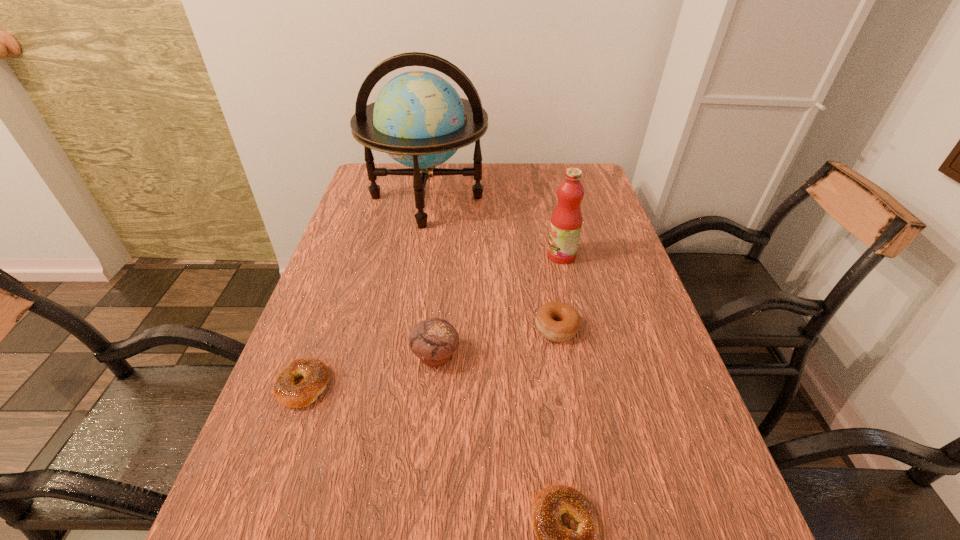
Locate an element on the screen. the tallest object is located at coordinates (418, 119).

Where is `globe`? globe is located at coordinates (418, 119).

Locate an element on the screen. This screenshot has height=540, width=960. the second tallest object is located at coordinates (566, 221).

Locate an element on the screen. the fifth nearest object is located at coordinates (566, 221).

Where is `the third tallest object`? This screenshot has height=540, width=960. the third tallest object is located at coordinates (434, 340).

Find the location of a particular element. This screenshot has height=540, width=960. the third shortest object is located at coordinates (559, 322).

This screenshot has height=540, width=960. What are the coordinates of `the tallest bagel` in the screenshot? It's located at (559, 322).

At what (x,y) coordinates should I click in order to perform the action: click on the second farthest bagel. Please return your answer as a coordinate pair (x, y). Looking at the image, I should click on (316, 375).

The height and width of the screenshot is (540, 960). I want to click on free location located on the surface of the tallest object, so click(x=405, y=324).

You are a GUI agent. You are given a task and a screenshot of the screen. Output one action in this format:
    pyautogui.click(x=<x>, y=<y>)
    Task: Click on the vacant space located on the front label of the fruit juice
    
    Given the screenshot: What is the action you would take?
    pyautogui.click(x=464, y=255)